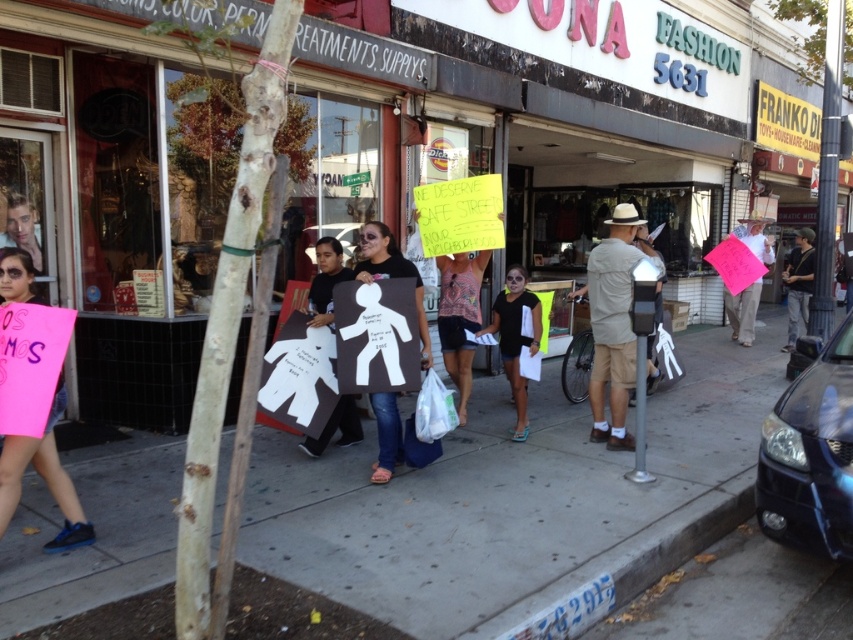
Question: Does concrete sidewalk at center appear on the left side of white paper figure at center?

Choices:
 (A) yes
 (B) no

Answer: (B)

Question: Can you confirm if pink paper sign at right is wider than dark gray shirt at center?

Choices:
 (A) yes
 (B) no

Answer: (B)

Question: Which point is farther from the camera taking this photo?

Choices:
 (A) (569, 545)
 (B) (389, 440)
 (C) (20, 435)
 (D) (784, 272)

Answer: (D)

Question: Can you confirm if matte black sign at center is bigger than matte black shorts at center?

Choices:
 (A) yes
 (B) no

Answer: (B)

Question: Considering the real-world distances, which object is closest to the pink paper sign at right?

Choices:
 (A) white paper figure at center
 (B) matte black shorts at center

Answer: (B)

Question: Which is farther from the matte black shorts at center?

Choices:
 (A) dark gray shirt at center
 (B) pink paper sign at right

Answer: (A)